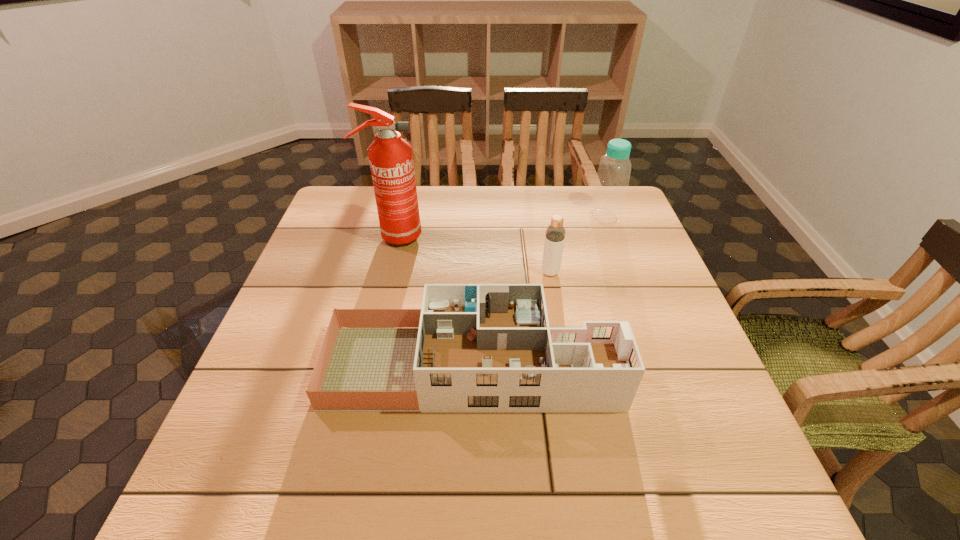
Where is `free location at the left edge of the desktop`? This screenshot has width=960, height=540. free location at the left edge of the desktop is located at coordinates (332, 245).

Identify the location of free space at the right edge. (628, 274).

Where is `vacant space at the far left corner`? vacant space at the far left corner is located at coordinates (352, 204).

The width and height of the screenshot is (960, 540). In the image, there is a desktop. In order to click on vacant space at the far right corner in this screenshot , I will do `click(581, 192)`.

Locate an element on the screen. Image resolution: width=960 pixels, height=540 pixels. free space between the second shortest object and the fire extinguisher is located at coordinates (471, 254).

You are a GUI agent. You are given a task and a screenshot of the screen. Output one action in this format:
    pyautogui.click(x=<x>, y=<y>)
    Task: Click on the vacant area that lies between the farther bottle and the tallest object
    
    Given the screenshot: What is the action you would take?
    pyautogui.click(x=499, y=226)

This screenshot has width=960, height=540. Find the location of `vacant point located between the rightmost object and the tallest object`. vacant point located between the rightmost object and the tallest object is located at coordinates (499, 226).

Where is `the second closest object to the shortest object`? The height and width of the screenshot is (540, 960). the second closest object to the shortest object is located at coordinates (391, 161).

Identify the location of object identified as the closest to the fire extinguisher. (472, 348).

Identify the location of vacant area in the image that satisfies the following two spatial constraints: 1. on the back side of the right bottle; 2. on the left side of the second shortest object. (540, 216).